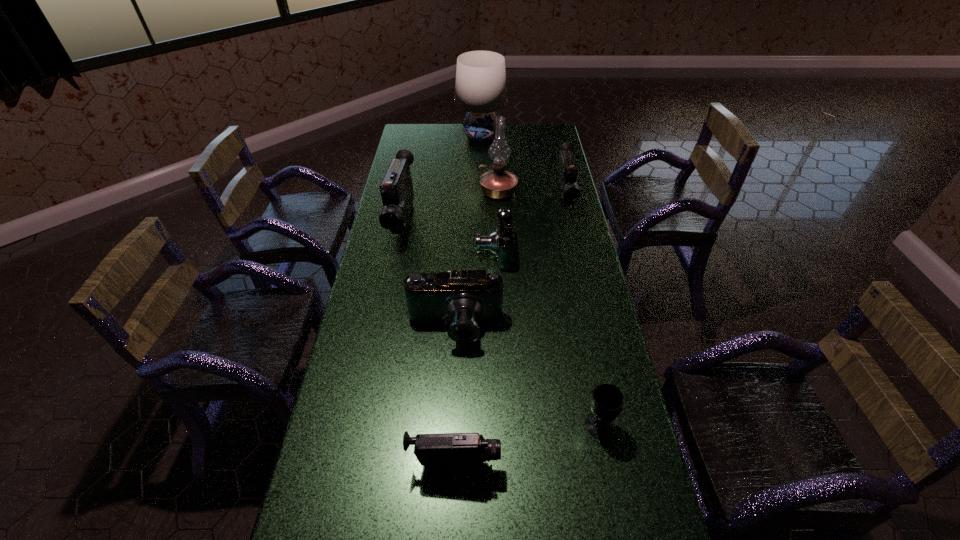
Identify the location of vacant area at the left edge. (355, 370).

Where is `vacant region at the right edge of the desktop`? vacant region at the right edge of the desktop is located at coordinates (613, 506).

Locate an element on the screen. This screenshot has height=540, width=960. vacant space at the far right corner is located at coordinates click(543, 145).

This screenshot has width=960, height=540. I want to click on unoccupied position between the nearest camcorder and the rightmost camcorder, so tap(510, 330).

Find the location of a particular element. vacant area that lies between the lampshade and the tallest camcorder is located at coordinates (442, 180).

This screenshot has width=960, height=540. In order to click on unoccupied position between the rightmost black camcorder and the farther blue camcorder in this screenshot , I will do `click(529, 224)`.

Find the location of a particular element. vacant area that lies between the smaller blue camcorder and the smallest black camcorder is located at coordinates (474, 357).

Locate an element on the screen. The image size is (960, 540). vacant space that is in between the seventh farthest object and the farther blue camcorder is located at coordinates (546, 338).

You are a GUI agent. You are given a task and a screenshot of the screen. Output one action in this format:
    pyautogui.click(x=<x>, y=<y>)
    Task: Click on the free point between the lampshade and the second nearest object
    
    Given the screenshot: What is the action you would take?
    pyautogui.click(x=540, y=281)

Identify which object is the fifth nearest to the lampshade. Please provide its 2D coordinates. Your answer should be formatted as a tuple, i.e. [(x, y)], where the tuple contains the x and y coordinates of a point satisfying the conditions above.

[(463, 299)]